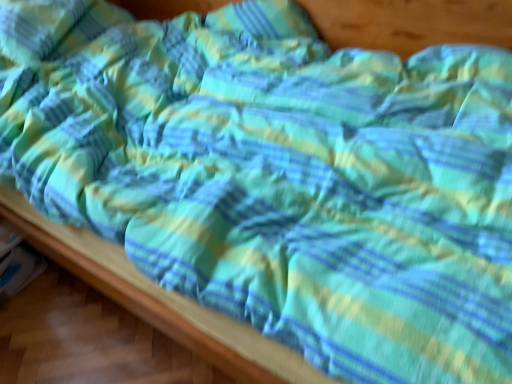
This screenshot has width=512, height=384. What do you see at coordinates (17, 262) in the screenshot?
I see `white paper at lower left` at bounding box center [17, 262].

Where is `white paper at lower left`? This screenshot has width=512, height=384. white paper at lower left is located at coordinates (17, 262).

Identify the location of white paper at lower left. The image size is (512, 384). (17, 262).